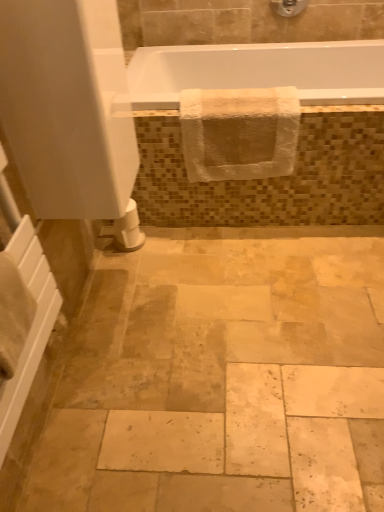
Question: Is white glossy bathtub at upper center smaller than white textured towel at upper center?

Choices:
 (A) no
 (B) yes

Answer: (A)

Question: Is white textured towel at upper center located within white glossy bathtub at upper center?

Choices:
 (A) yes
 (B) no

Answer: (A)

Question: From the image's perspective, is white glossy bathtub at upper center below white textured towel at upper center?

Choices:
 (A) no
 (B) yes

Answer: (A)

Question: Can you confirm if white glossy bathtub at upper center is bigger than white textured towel at upper center?

Choices:
 (A) no
 (B) yes

Answer: (B)

Question: Is white textured towel at upper center at the back of white glossy bathtub at upper center?

Choices:
 (A) yes
 (B) no

Answer: (A)

Question: Is white glossy bathtub at upper center positioned before white textured towel at upper center?

Choices:
 (A) no
 (B) yes

Answer: (A)

Question: Is white matte toilet paper at lower left taller than white glossy bathtub at upper center?

Choices:
 (A) yes
 (B) no

Answer: (B)

Question: Does white matte toilet paper at lower left turn towards white glossy bathtub at upper center?

Choices:
 (A) yes
 (B) no

Answer: (B)

Question: From the image's perspective, is white matte toilet paper at lower left on white glossy bathtub at upper center?

Choices:
 (A) yes
 (B) no

Answer: (B)

Question: From the image's perspective, would you say white matte toilet paper at lower left is shown under white glossy bathtub at upper center?

Choices:
 (A) no
 (B) yes

Answer: (B)

Question: Is white matte toilet paper at lower left with white glossy bathtub at upper center?

Choices:
 (A) yes
 (B) no

Answer: (B)

Question: Is white matte toilet paper at lower left smaller than white glossy bathtub at upper center?

Choices:
 (A) no
 (B) yes

Answer: (B)

Question: Does white matte screen door at upper left have a larger size compared to matte silver showerhead at upper center?

Choices:
 (A) yes
 (B) no

Answer: (A)